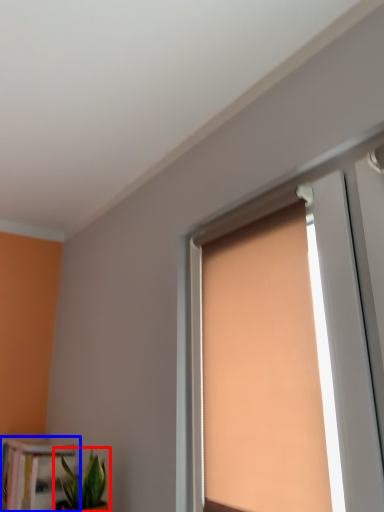
Question: Which of the following is the farthest to the observer, houseplant (highlighted by a red box) or bookcase (highlighted by a blue box)?

Choices:
 (A) houseplant
 (B) bookcase

Answer: (B)